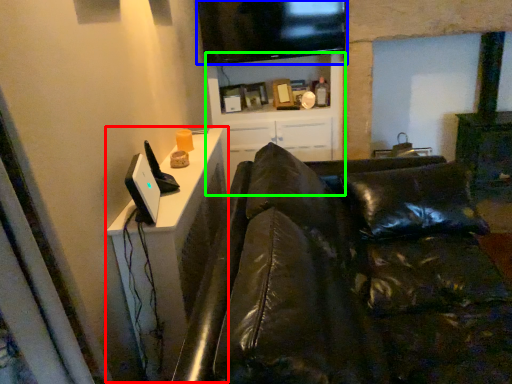
Question: Which is farther away from dresser (highlighted by a red box)? television (highlighted by a blue box) or entertainment center (highlighted by a green box)?

Choices:
 (A) television
 (B) entertainment center

Answer: (B)